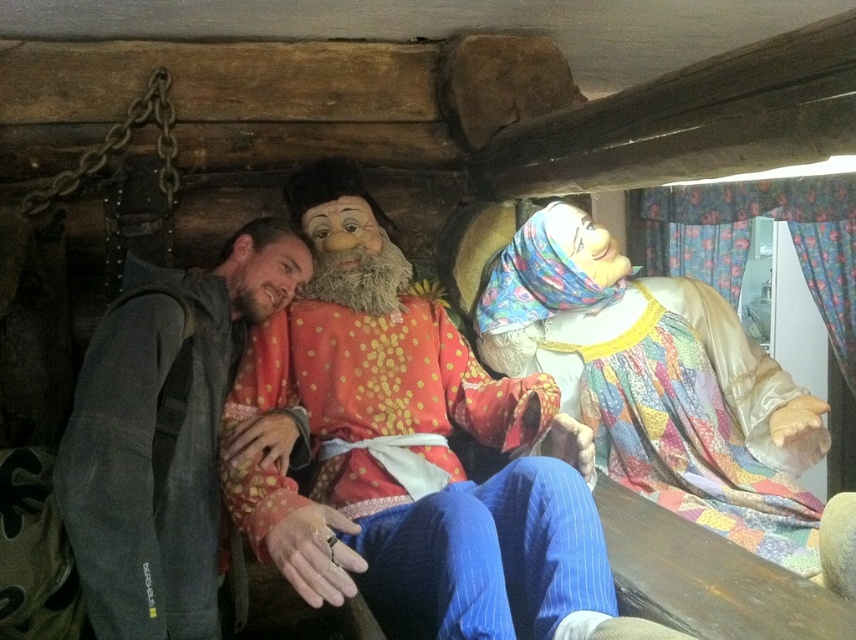
How distant is red velvet robe at center from multicolored fabric dress at upper right?

red velvet robe at center and multicolored fabric dress at upper right are 20.19 inches apart.

Is point (456, 500) more distant than point (616, 301)?

No.

Describe the element at coordinates (450, 541) in the screenshot. The image size is (856, 640). I see `red velvet robe at center` at that location.

You are a GUI agent. You are given a task and a screenshot of the screen. Output one action in this format:
    pyautogui.click(x=<x>, y=<y>)
    Task: Click on the red velvet robe at center
    The width and height of the screenshot is (856, 640).
    Given the screenshot: What is the action you would take?
    (x=450, y=541)

Which is above, red velvet robe at center or gray fabric jacket at left?

Positioned higher is gray fabric jacket at left.

Between red velvet robe at center and gray fabric jacket at left, which one has more height?

gray fabric jacket at left is taller.

Who is more distant from viewer, (382, 515) or (289, 426)?

Positioned behind is point (289, 426).

Locate an element on the screen. red velvet robe at center is located at coordinates (450, 541).

How much distance is there between multicolored fabric dress at upper right and gray fabric jacket at left?

A distance of 34.56 inches exists between multicolored fabric dress at upper right and gray fabric jacket at left.

How far apart are multicolored fabric dress at upper right and gray fabric jacket at left?

multicolored fabric dress at upper right and gray fabric jacket at left are 34.56 inches apart.

Measure the distance between multicolored fabric dress at upper right and camera.

The distance of multicolored fabric dress at upper right from camera is 5.13 feet.

This screenshot has width=856, height=640. I want to click on multicolored fabric dress at upper right, so click(658, 384).